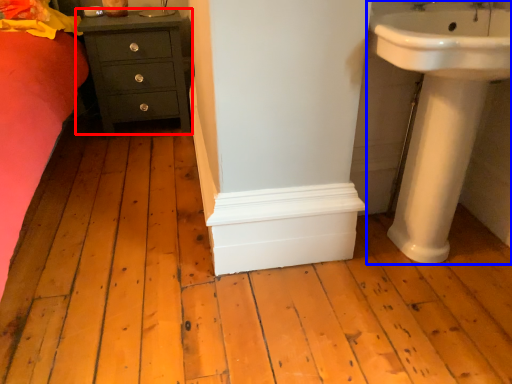
Question: Which point is further to the camera, chest of drawers (highlighted by a red box) or sink (highlighted by a blue box)?

Choices:
 (A) chest of drawers
 (B) sink

Answer: (A)